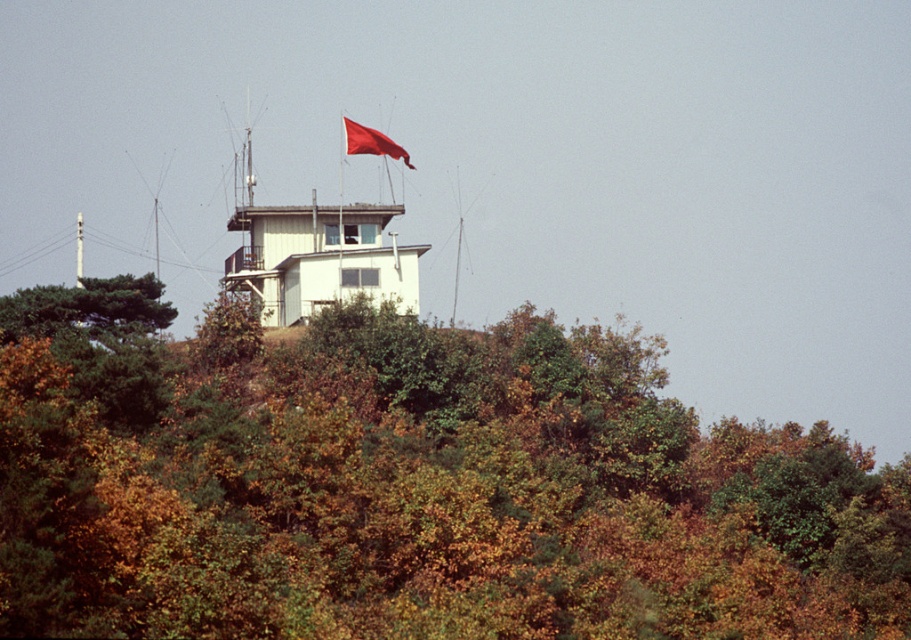
Question: Which point is farther from the camera taking this photo?

Choices:
 (A) (354, 144)
 (B) (597, 624)

Answer: (A)

Question: Is green matte tree at upper center positioned behind red fabric flag at upper center?

Choices:
 (A) no
 (B) yes

Answer: (A)

Question: Which of the following is the closest to the observer?

Choices:
 (A) red fabric flag at upper center
 (B) green matte tree at upper center

Answer: (B)

Question: Can you confirm if green matte tree at upper center is positioned below red fabric flag at upper center?

Choices:
 (A) no
 (B) yes

Answer: (B)

Question: Can you confirm if green matte tree at upper center is smaller than red fabric flag at upper center?

Choices:
 (A) no
 (B) yes

Answer: (A)